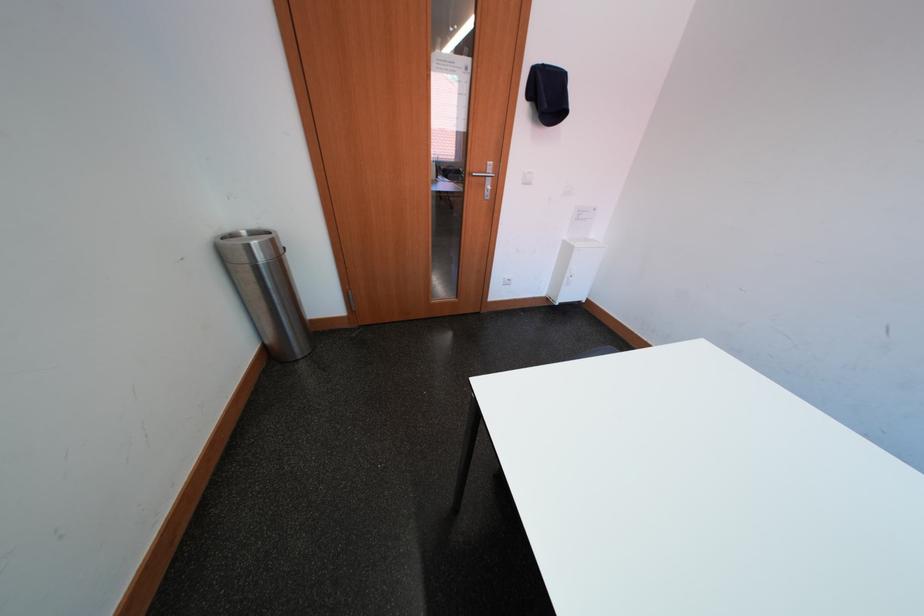
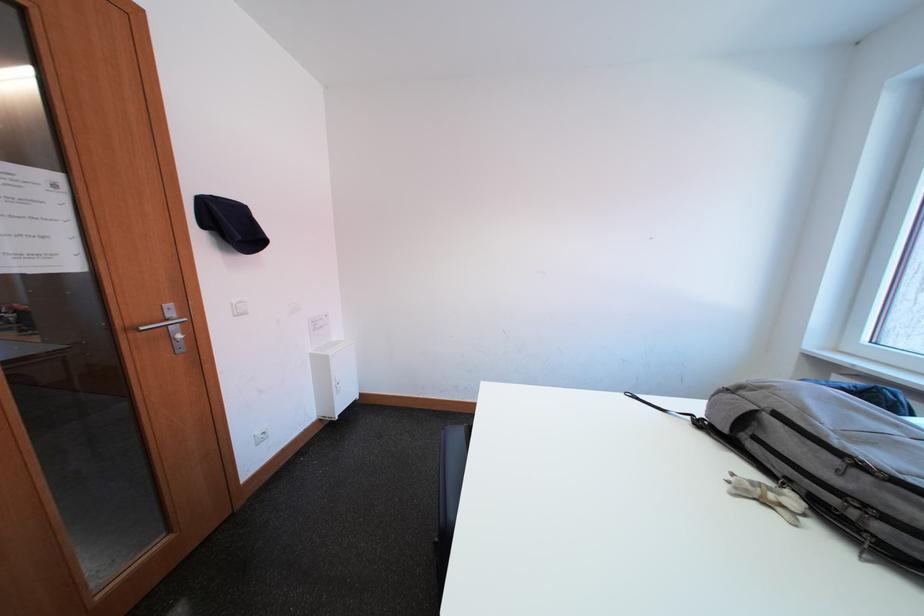
Question: The camera is either moving clockwise (left) or counter-clockwise (right) around the object. The first image is from the beginning of the video and the second image is from the end. Is the camera moving left or right when shooting the video?

Choices:
 (A) Left
 (B) Right

Answer: (A)